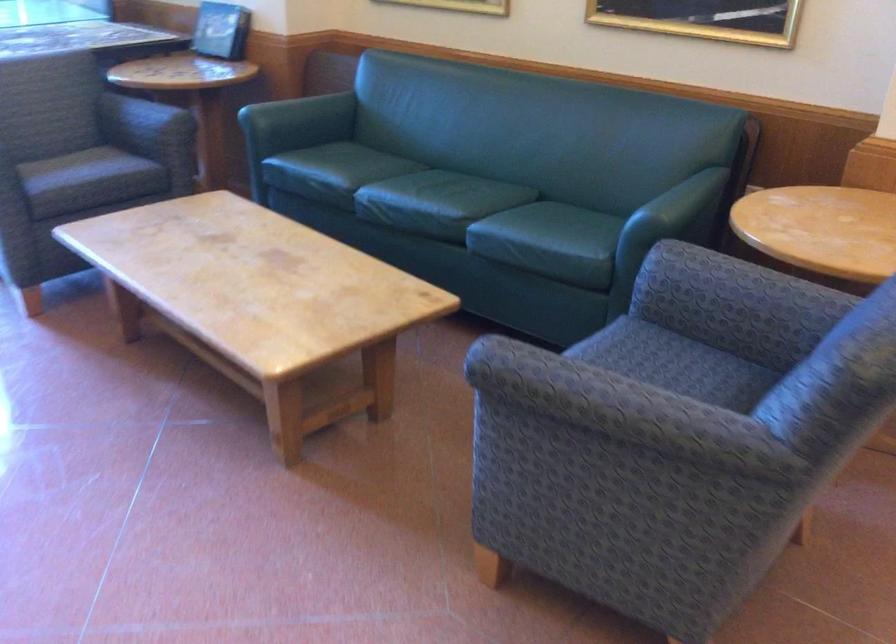
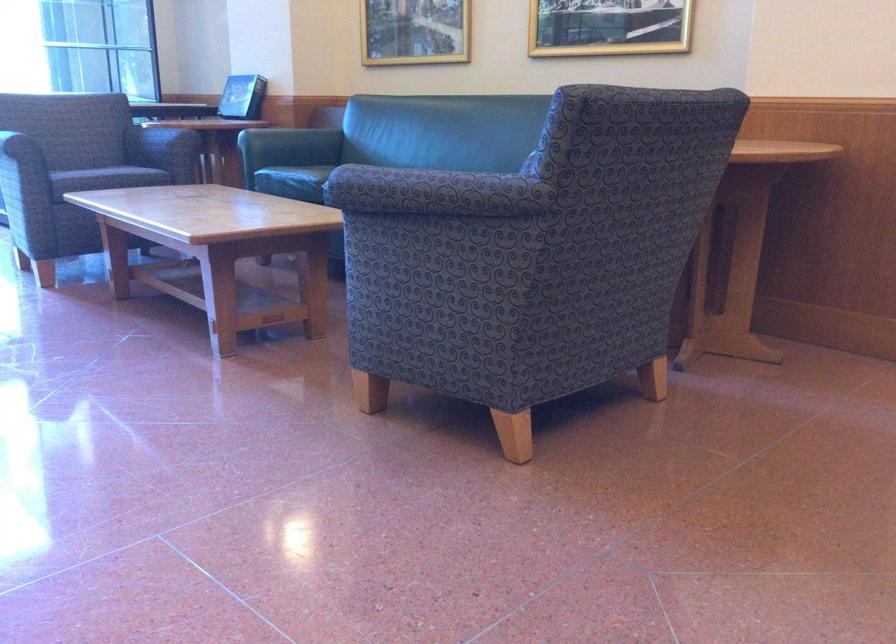
In the second image, find the point that corresponds to (109,187) in the first image.

(115, 176)